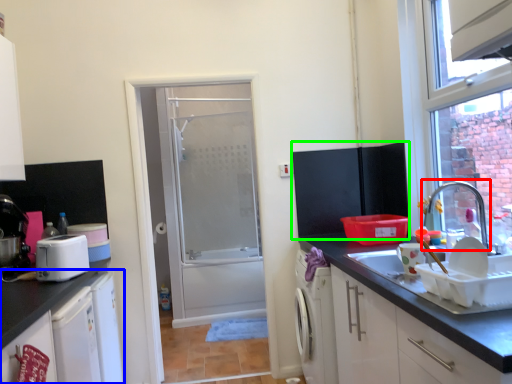
Question: Considering the real-world distances, which object is farthest from tap (highlighted by a red box)? cabinetry (highlighted by a blue box) or wide (highlighted by a green box)?

Choices:
 (A) cabinetry
 (B) wide

Answer: (A)